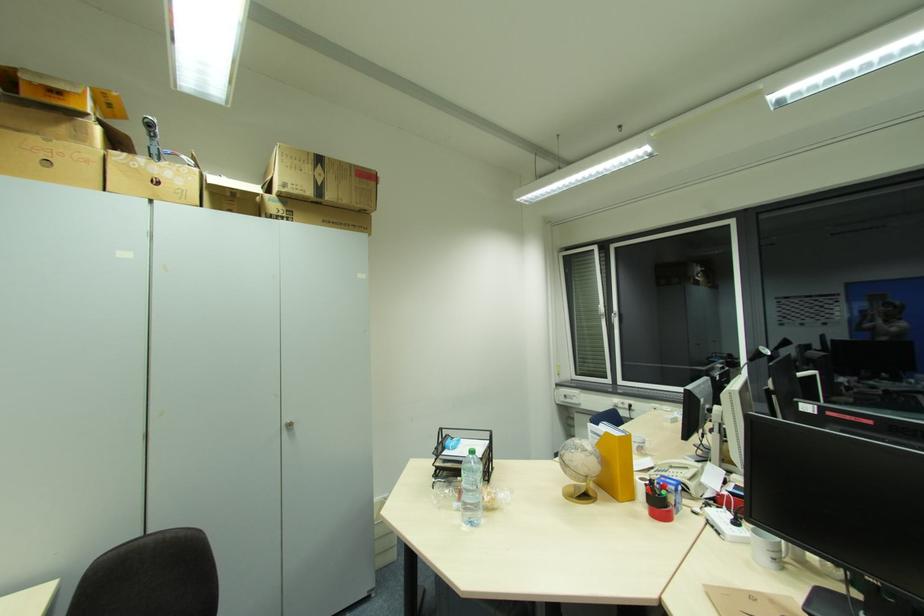
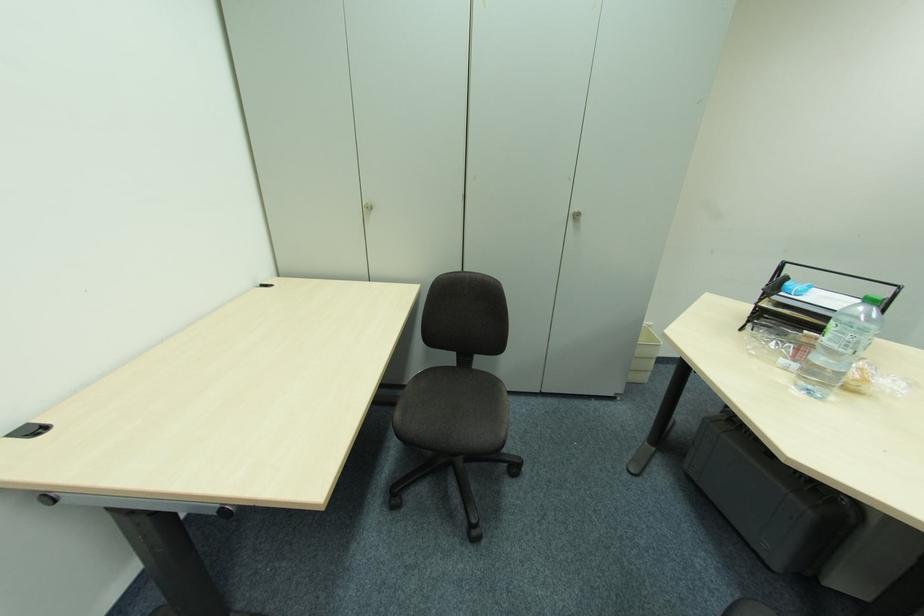
The point at (476, 485) is marked in the first image. Where is the corresponding point in the second image?

(850, 347)